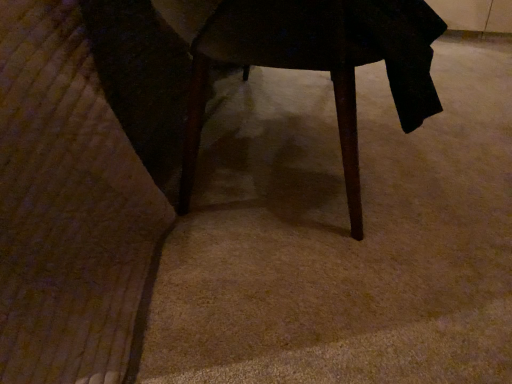
What do you see at coordinates (320, 64) in the screenshot?
I see `dark wood chair at center` at bounding box center [320, 64].

Measure the distance between dark wood chair at center and camera.

dark wood chair at center and camera are 26.93 inches apart.

The width and height of the screenshot is (512, 384). What are the coordinates of `dark wood chair at center` in the screenshot? It's located at (320, 64).

You are a GUI agent. You are given a task and a screenshot of the screen. Output one action in this format:
    pyautogui.click(x=<x>, y=<y>)
    Task: Click on the dark wood chair at center
    The height and width of the screenshot is (384, 512).
    Given the screenshot: What is the action you would take?
    pyautogui.click(x=320, y=64)